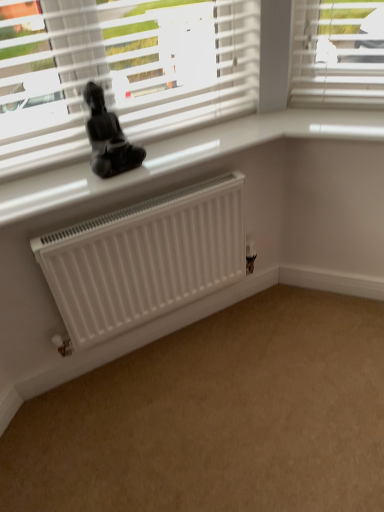
Question: In terms of size, does white matte radiator at lower left appear bigger or smaller than white matte radiator at center?

Choices:
 (A) big
 (B) small

Answer: (A)

Question: From the image's perspective, is white matte radiator at lower left positioned above or below white matte radiator at center?

Choices:
 (A) above
 (B) below

Answer: (B)

Question: Estimate the real-world distances between objects in this image. Which object is farther from the white matte radiator at lower left?

Choices:
 (A) white glossy window sill at upper center
 (B) white matte radiator at center
 (C) black glossy statue at upper center

Answer: (C)

Question: Considering the real-world distances, which object is closest to the black glossy statue at upper center?

Choices:
 (A) white matte radiator at lower left
 (B) white glossy window sill at upper center
 (C) white matte radiator at center

Answer: (B)